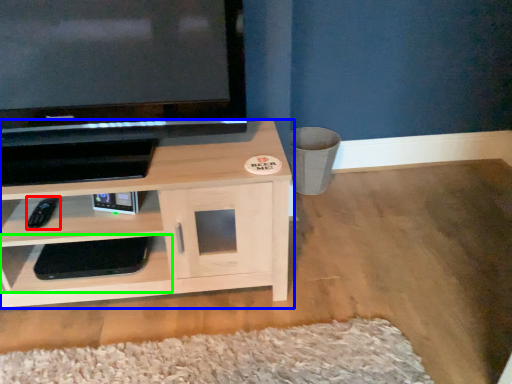
Question: Estimate the real-world distances between objects in this image. Which object is farther from remote (highlighted by a red box), shelf (highlighted by a blue box) or shelf (highlighted by a green box)?

Choices:
 (A) shelf
 (B) shelf

Answer: (A)